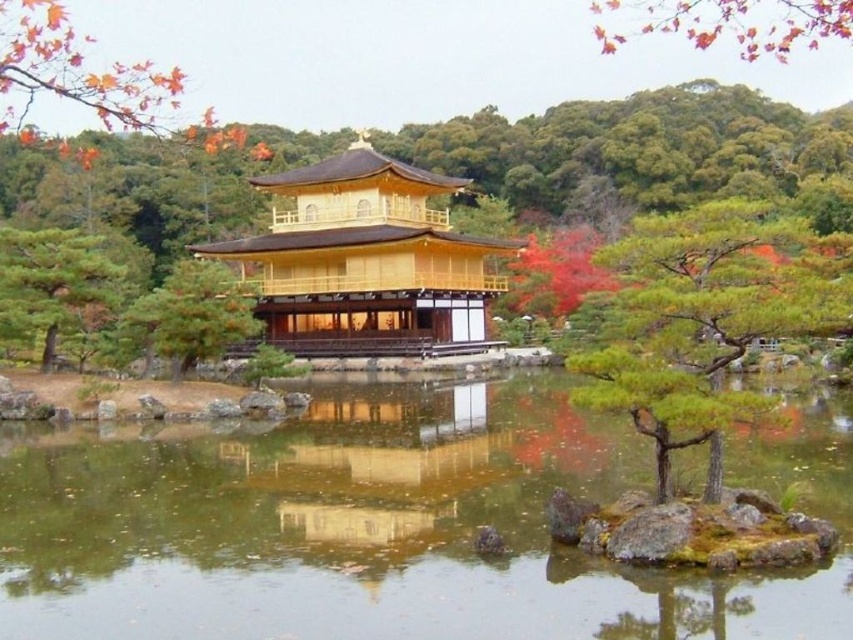
You are standing at the edge of the pond in front of the Golden Pavilion. There is a point marked at coordinates (389,524) which is clear water at center. Can you confirm if this point is located in the clear water area of the pond?

Yes, the point marked at coordinates (389,524) is located in the clear water at center, so it is within the clear water area of the pond.

You are standing at the edge of the pond in front of the Golden Pavilion. There is a point marked at coordinates (389, 524). What is located at this point?

The point at coordinates (389, 524) corresponds to clear water at center.